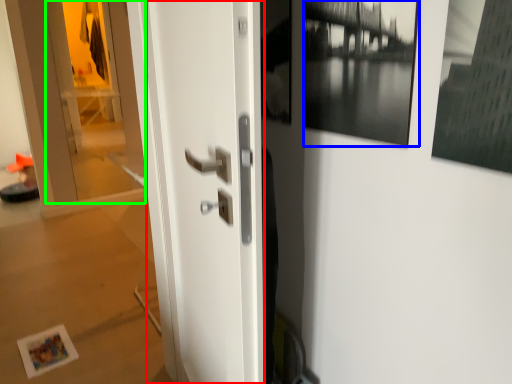
Question: Estimate the real-world distances between objects in this image. Which object is closer to door (highlighted by a red box), picture frame (highlighted by a blue box) or glass door (highlighted by a green box)?

Choices:
 (A) picture frame
 (B) glass door

Answer: (A)